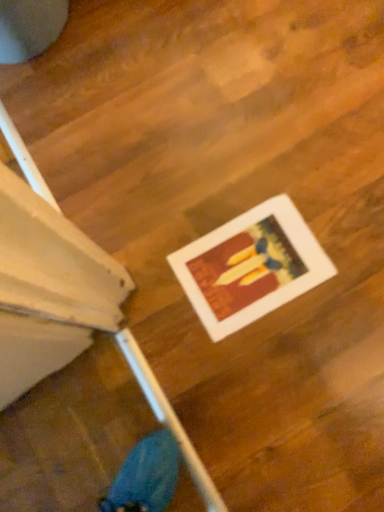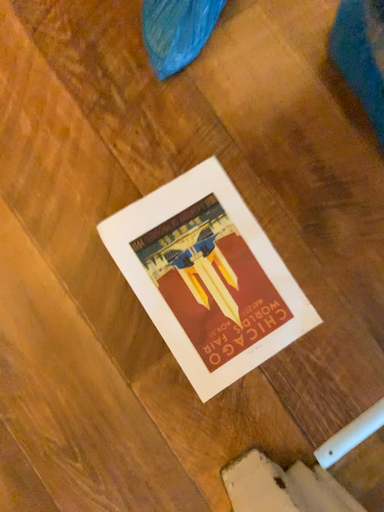
Question: Which way did the camera rotate in the video?

Choices:
 (A) rotated left
 (B) rotated right

Answer: (B)